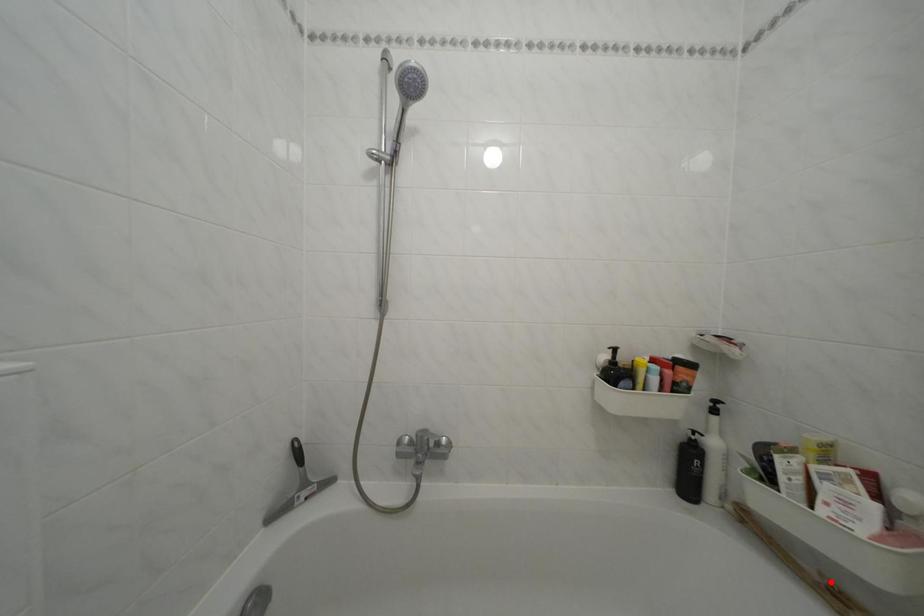
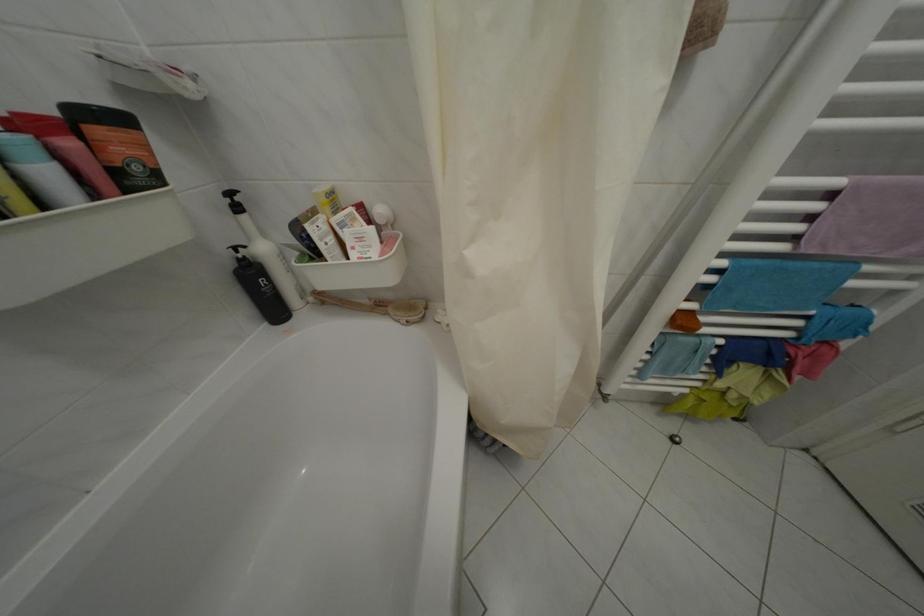
The point at the highlighted location is marked in the first image. Where is the corresponding point in the second image?

(379, 306)